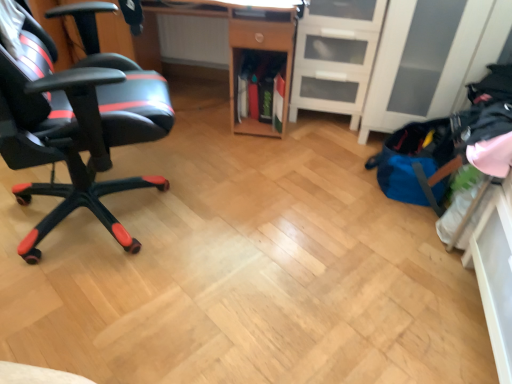
Question: Is black matte gaming chair at left positioned with its back to wooden desk at center?

Choices:
 (A) no
 (B) yes

Answer: (A)

Question: From the image's perspective, would you say black matte gaming chair at left is positioned over wooden desk at center?

Choices:
 (A) yes
 (B) no

Answer: (B)

Question: Is black matte gaming chair at left with wooden desk at center?

Choices:
 (A) yes
 (B) no

Answer: (B)

Question: Considering the relative sizes of black matte gaming chair at left and wooden desk at center in the image provided, is black matte gaming chair at left thinner than wooden desk at center?

Choices:
 (A) yes
 (B) no

Answer: (B)

Question: Is black matte gaming chair at left to the right of wooden desk at center from the viewer's perspective?

Choices:
 (A) no
 (B) yes

Answer: (A)

Question: Is black matte gaming chair at left positioned before wooden desk at center?

Choices:
 (A) yes
 (B) no

Answer: (A)

Question: From the image's perspective, is white matte file cabinet at center right below black matte gaming chair at left?

Choices:
 (A) no
 (B) yes

Answer: (A)

Question: From the image's perspective, does white matte file cabinet at center right appear higher than black matte gaming chair at left?

Choices:
 (A) yes
 (B) no

Answer: (A)

Question: Is white matte file cabinet at center right bigger than black matte gaming chair at left?

Choices:
 (A) yes
 (B) no

Answer: (B)

Question: Is white matte file cabinet at center right positioned with its back to black matte gaming chair at left?

Choices:
 (A) no
 (B) yes

Answer: (A)

Question: Is white matte file cabinet at center right located outside black matte gaming chair at left?

Choices:
 (A) yes
 (B) no

Answer: (A)

Question: Does white matte file cabinet at center right lie in front of black matte gaming chair at left?

Choices:
 (A) no
 (B) yes

Answer: (A)

Question: Does white matte file cabinet at center right have a smaller size compared to wooden desk at center?

Choices:
 (A) yes
 (B) no

Answer: (A)